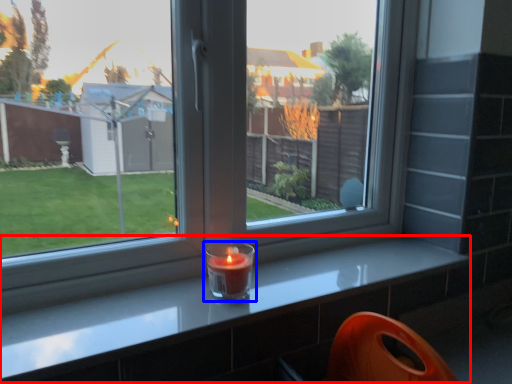
Question: Which object is closer to the camera taking this photo, counter (highlighted by a red box) or candle holder (highlighted by a blue box)?

Choices:
 (A) counter
 (B) candle holder

Answer: (A)